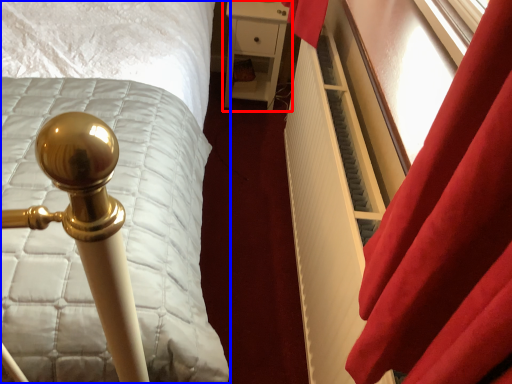
Question: Which of the following is the closest to the observer, furniture (highlighted by a red box) or bed (highlighted by a blue box)?

Choices:
 (A) furniture
 (B) bed

Answer: (B)